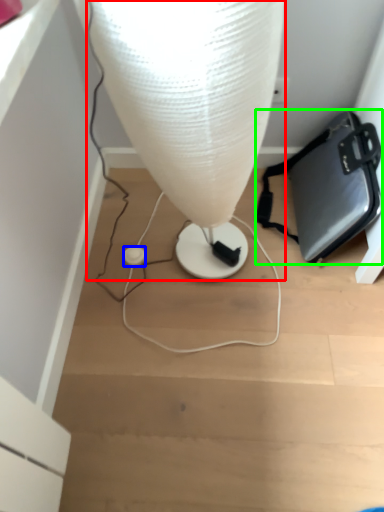
Question: Which is farther away from lamp (highlighted by a red box)? earphone (highlighted by a blue box) or handbag (highlighted by a green box)?

Choices:
 (A) earphone
 (B) handbag

Answer: (A)